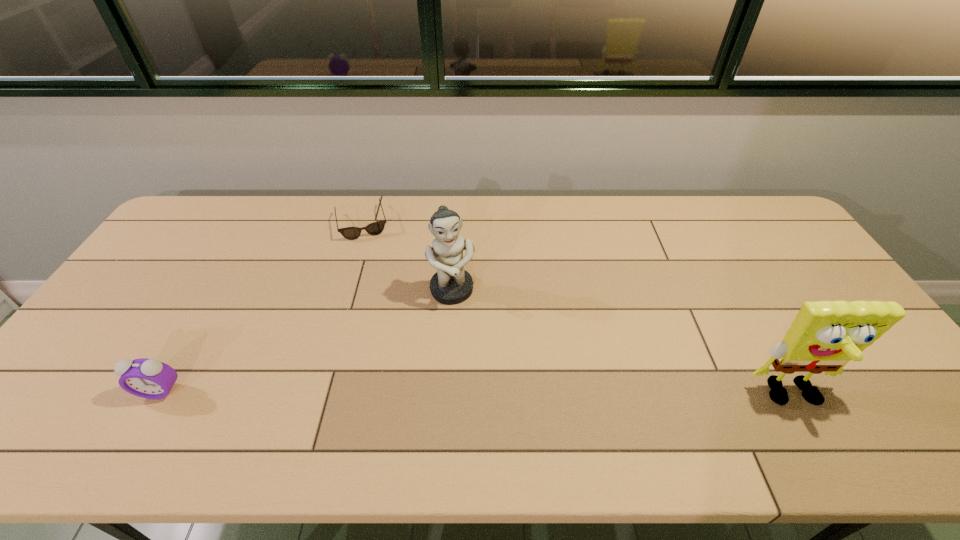
Find the location of `free space on the desktop that is between the leftmost object and the rightmost object and is positioned on the front-facing side of the figurine`. free space on the desktop that is between the leftmost object and the rightmost object and is positioned on the front-facing side of the figurine is located at coordinates (477, 394).

The height and width of the screenshot is (540, 960). Identify the location of free spot on the desktop that is between the leftmost object and the rightmost object and is positioned on the front lenses of the farthest object. (399, 393).